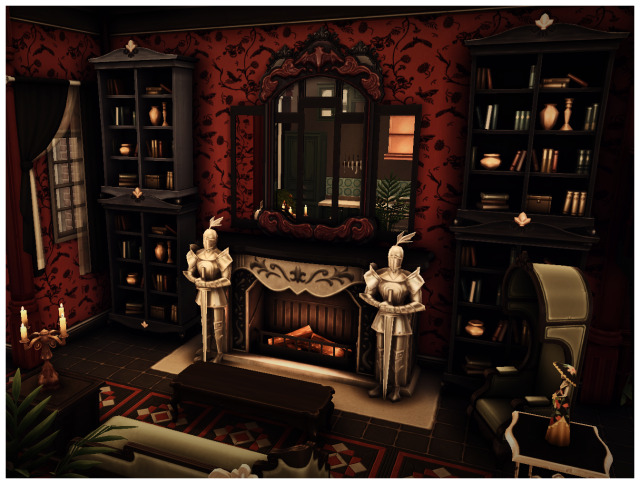
Where is `mantle`? Image resolution: width=640 pixels, height=484 pixels. mantle is located at coordinates (330, 256).